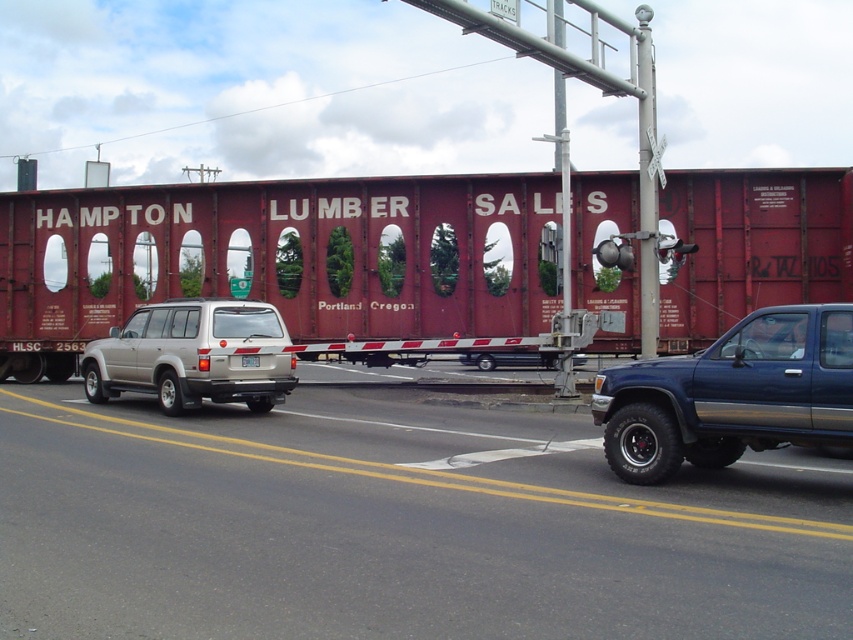
You are a driver in the beige SUV on the left. You want to know if the point at coordinates (283, 260) is on the same vehicle as you. Is it?

The point at coordinates (283, 260) is on the matte red truck at center, so it is not on the same vehicle as the beige SUV on the left.

You are a traffic officer observing the railway crossing scene. There is a blue metallic truck at right. Can you determine its exact position using coordinates?

The blue metallic truck at right is located at point coordinates 0.617 and 0.858.

You are driving a car and want to pass through the railway crossing. You see the blue metallic truck at right and the satin silver suv at center. Which vehicle should you wait behind?

The blue metallic truck at right is in front of the satin silver suv at center, so you should wait behind the blue metallic truck at right.